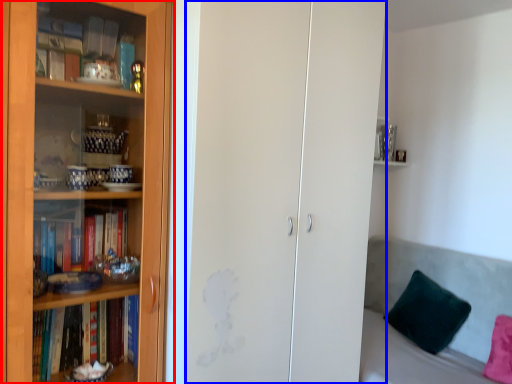
Question: Which point is further to the camera, bookcase (highlighted by a red box) or glass door (highlighted by a blue box)?

Choices:
 (A) bookcase
 (B) glass door

Answer: (B)